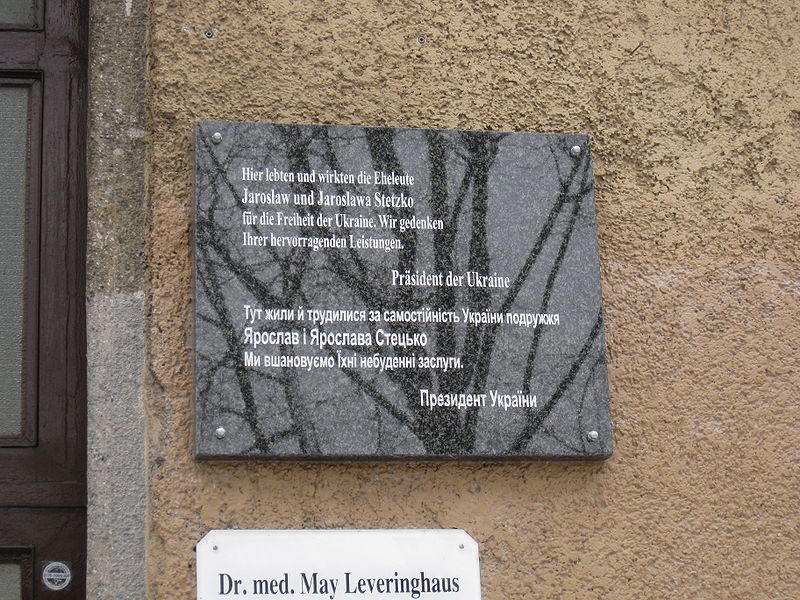
I want to click on darker cement wall trim, so click(116, 170).